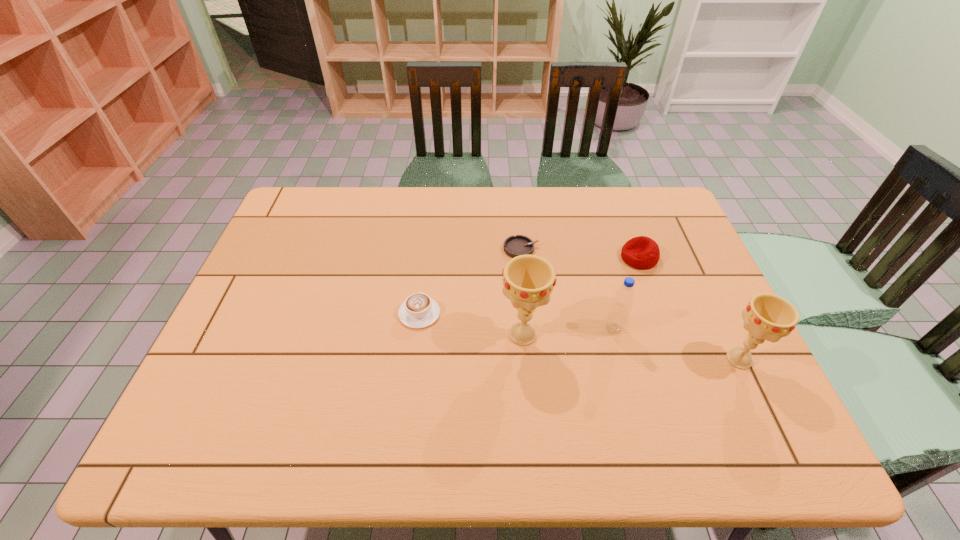
Identify the location of object that is positioned at the near edge. The height and width of the screenshot is (540, 960). (769, 317).

Where is `chalice located at the right edge`? chalice located at the right edge is located at coordinates (769, 317).

This screenshot has height=540, width=960. I want to click on beanbag that is at the right edge, so click(x=641, y=252).

Identify the location of object that is positioned at the near right corner. The height and width of the screenshot is (540, 960). (x=769, y=317).

Find the location of `vacant area at the far edge of the desktop`. vacant area at the far edge of the desktop is located at coordinates coord(369,206).

In the image, there is a desktop. At what (x,y) coordinates should I click in order to perform the action: click on vacant area at the near edge. Please return your answer as a coordinate pair (x, y). The image size is (960, 540). Looking at the image, I should click on (391, 401).

The height and width of the screenshot is (540, 960). Find the location of `vacant position at the left edge of the desktop`. vacant position at the left edge of the desktop is located at coordinates (253, 300).

Locate an element on the screen. The width and height of the screenshot is (960, 540). vacant area at the right edge is located at coordinates (673, 276).

Where is `free space at the far left corner`? free space at the far left corner is located at coordinates (300, 198).

Where is `free region at the far right corner of the desktop`? This screenshot has width=960, height=540. free region at the far right corner of the desktop is located at coordinates (651, 207).